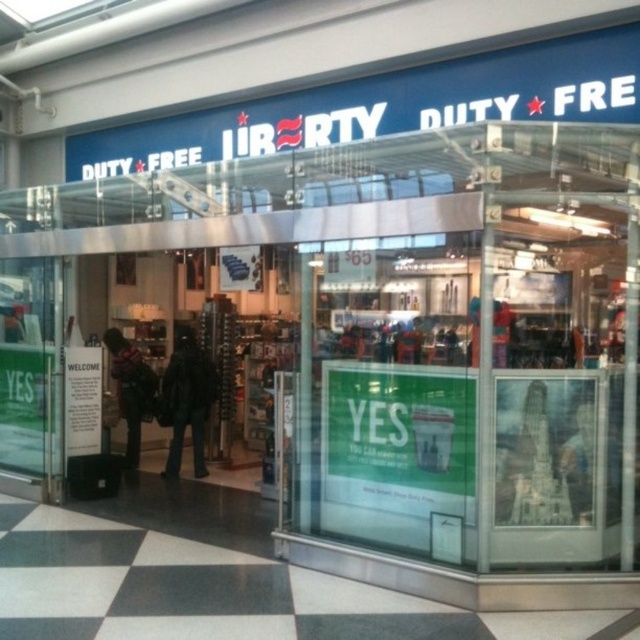
Question: Is black fuzzy coat at center in front of dark gray sweater at left?

Choices:
 (A) yes
 (B) no

Answer: (A)

Question: Which of the following is the farthest from the observer?

Choices:
 (A) dark gray sweater at left
 (B) transparent glass door at left

Answer: (A)

Question: In this image, where is black fuzzy coat at center located relative to dark gray sweater at left?

Choices:
 (A) below
 (B) above

Answer: (A)

Question: Which object appears closest to the camera in this image?

Choices:
 (A) dark gray sweater at left
 (B) black fuzzy coat at center

Answer: (B)

Question: Among these objects, which one is nearest to the camera?

Choices:
 (A) black fuzzy coat at center
 (B) dark gray sweater at left
 (C) transparent glass door at left

Answer: (C)

Question: Does black fuzzy coat at center appear on the left side of dark gray sweater at left?

Choices:
 (A) no
 (B) yes

Answer: (A)